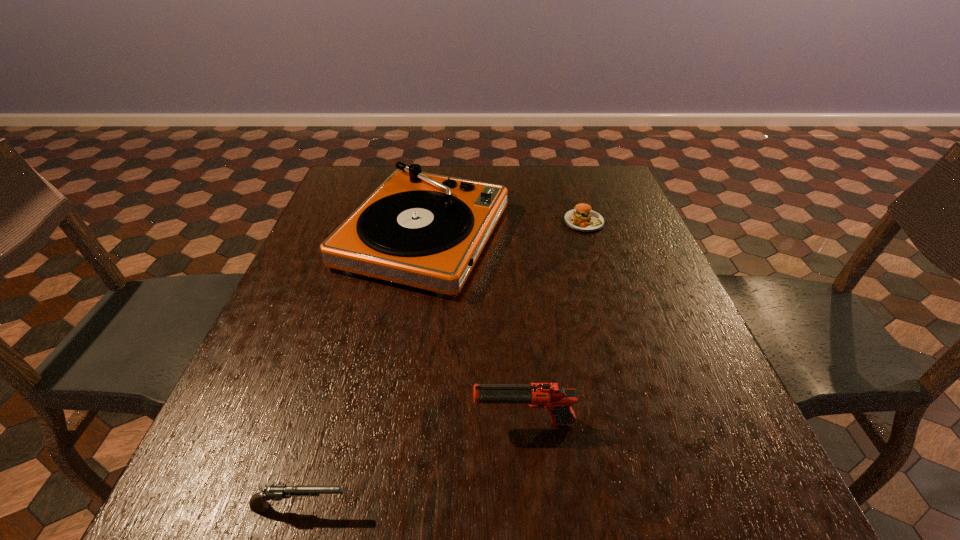
Where is `blank area at the far edge`? The width and height of the screenshot is (960, 540). blank area at the far edge is located at coordinates (531, 187).

Find the location of `free space at the near edge`. free space at the near edge is located at coordinates (561, 532).

I want to click on blank area at the left edge, so click(297, 397).

Find the location of `free space at the right edge of the desktop`. free space at the right edge of the desktop is located at coordinates (655, 404).

Identify the location of vacant space in between the record player and the patty. This screenshot has height=540, width=960. (504, 228).

At what (x,y) coordinates should I click in order to perform the action: click on vacant area between the rightmost object and the taller gun. Please return your answer as a coordinate pair (x, y). This screenshot has height=540, width=960. Looking at the image, I should click on (554, 322).

Locate an element on the screen. The image size is (960, 540). free point between the record player and the rightmost object is located at coordinates (504, 228).

What are the coordinates of `free spot between the third tallest object and the rightmost object` in the screenshot? It's located at (x=443, y=364).

Locate an element on the screen. This screenshot has width=960, height=540. free space between the record player and the left gun is located at coordinates (362, 372).

Image resolution: width=960 pixels, height=540 pixels. Find the location of `unoccupied position between the record player and the second shortest object`. unoccupied position between the record player and the second shortest object is located at coordinates (362, 372).